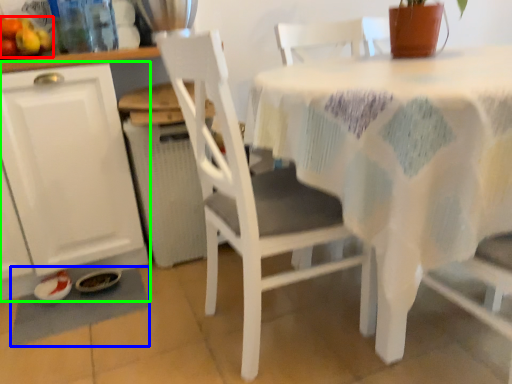
Question: Considering the real-world distances, which object is closest to fruit (highlighted by a red box)? place mat (highlighted by a blue box) or cabinetry (highlighted by a green box).

Choices:
 (A) place mat
 (B) cabinetry

Answer: (B)